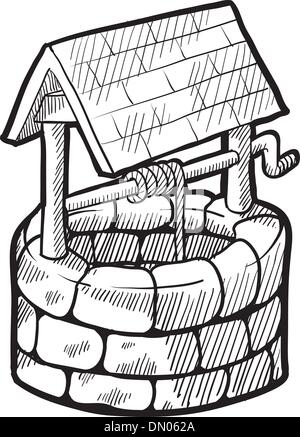
You are a GUI agent. You are given a task and a screenshot of the screen. Output one action in this format:
    pyautogui.click(x=<x>, y=<y>)
    Task: Click on the handle
    The image size is (300, 437).
    Given the screenshot: What is the action you would take?
    pyautogui.click(x=283, y=161)